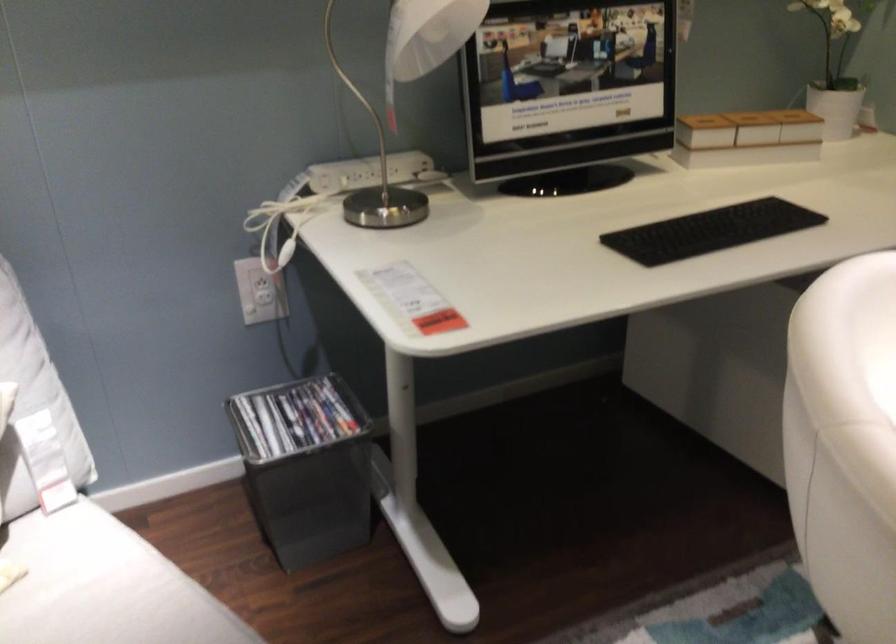
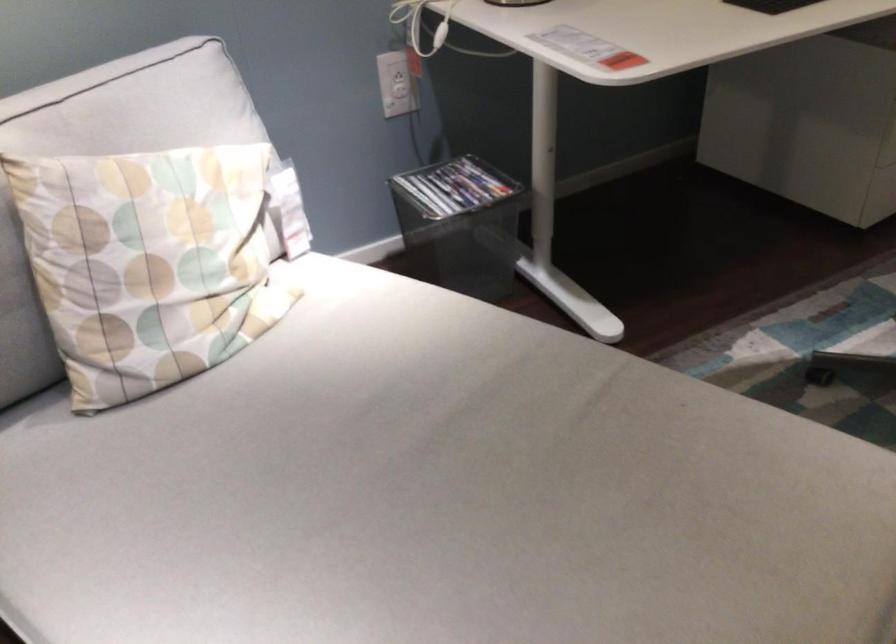
Where in the second image is the point corresponding to [281,297] from the first image?

(400, 91)